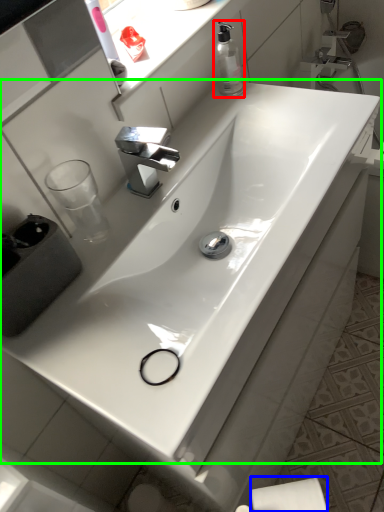
Question: Which object is the closest to the soap dispenser (highlighted by a red box)? Choose among these: toilet paper (highlighted by a blue box) or sink (highlighted by a green box).

Choices:
 (A) toilet paper
 (B) sink

Answer: (B)